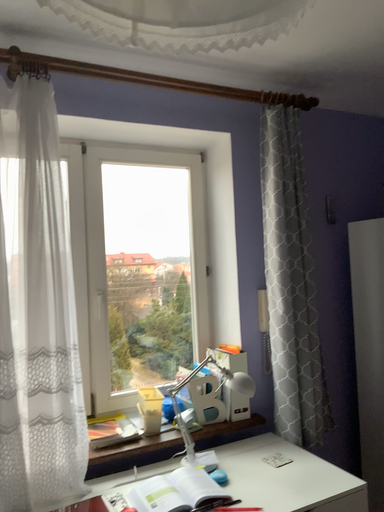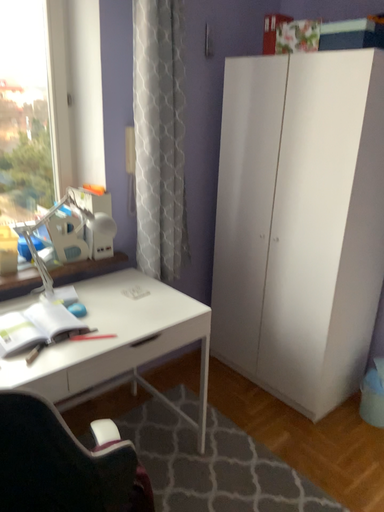
Question: Which way did the camera rotate in the video?

Choices:
 (A) rotated right
 (B) rotated left

Answer: (A)